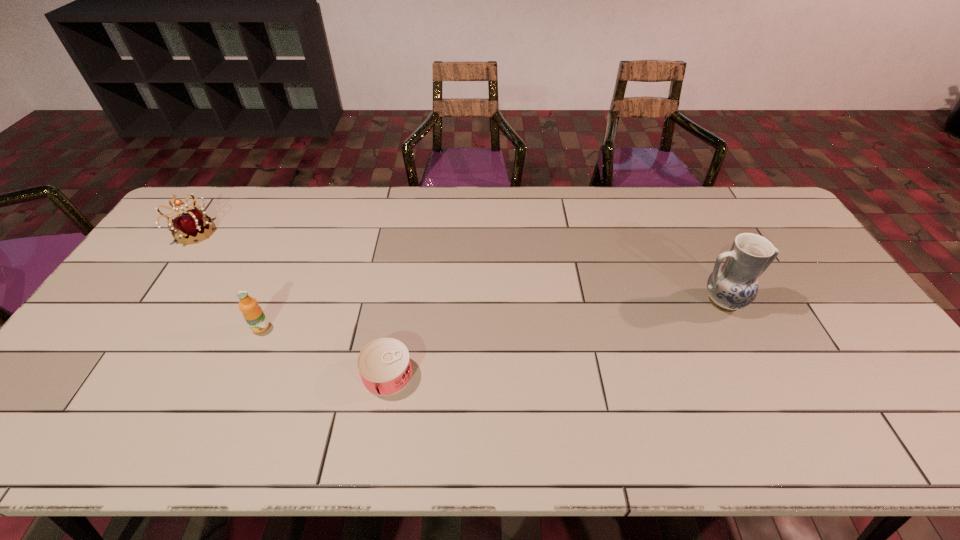
Locate an element on the screen. Image resolution: width=960 pixels, height=540 pixels. vacant area at the near right corner is located at coordinates (914, 450).

Locate an element on the screen. This screenshot has height=540, width=960. vacant area that lies between the shortest object and the tallest object is located at coordinates (555, 338).

Where is `vacant space in between the orange juice and the leftmost object`? vacant space in between the orange juice and the leftmost object is located at coordinates pyautogui.click(x=228, y=280).

Find the location of a particular element. This screenshot has height=540, width=960. free point between the tallest object and the tiara is located at coordinates (458, 267).

The width and height of the screenshot is (960, 540). I want to click on vacant area between the third farthest object and the rightmost object, so click(492, 315).

The height and width of the screenshot is (540, 960). What are the coordinates of `free space that is in between the pottery and the leftmost object` in the screenshot? It's located at (458, 267).

What are the coordinates of `empty space between the nearest object and the third farthest object` in the screenshot? It's located at (324, 351).

In order to click on empty location between the leftmost object and the orange juice in this screenshot , I will do `click(228, 280)`.

At what (x,y) coordinates should I click in order to perform the action: click on free space between the tiara and the orange juice. Please return your answer as a coordinate pair (x, y). The height and width of the screenshot is (540, 960). Looking at the image, I should click on (228, 280).

This screenshot has height=540, width=960. In order to click on free space between the leftmost object and the nearest object in this screenshot , I will do `click(290, 303)`.